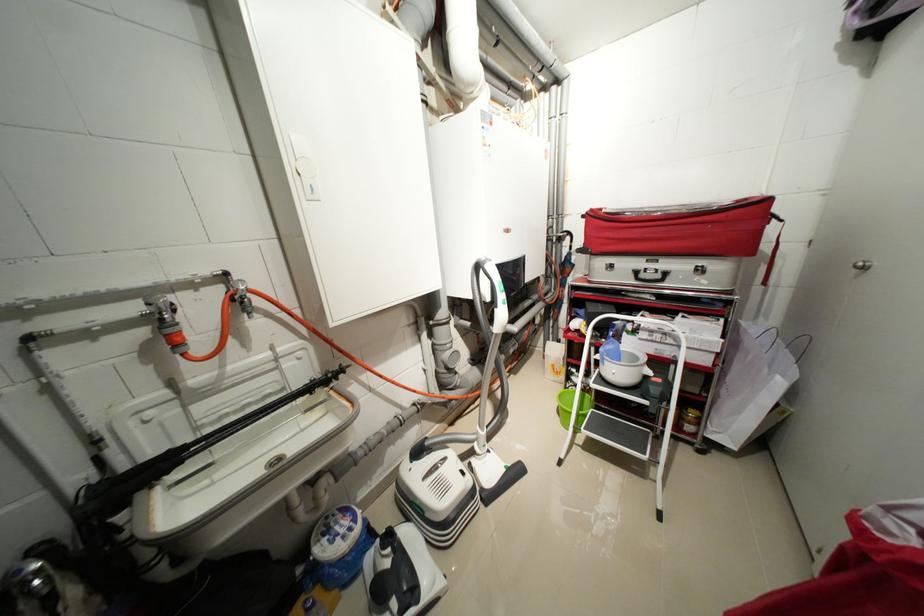
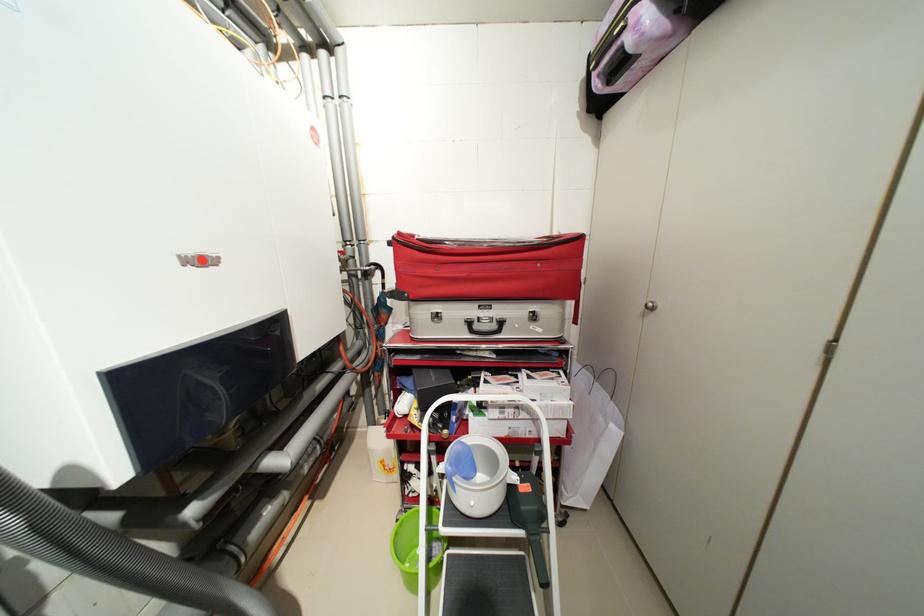
Where in the second image is the point corresponding to (x=599, y=211) from the first image?

(407, 235)